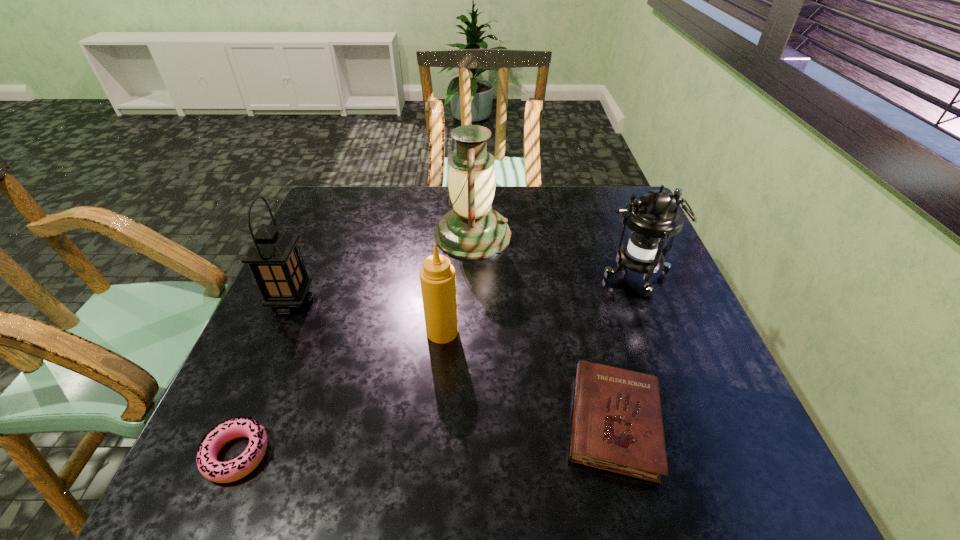
The height and width of the screenshot is (540, 960). What are the coordinates of `free location that satisfies the following two spatial constraints: 1. on the front side of the third nearest object; 2. on the right side of the leftmost lantern` in the screenshot? It's located at (279, 332).

This screenshot has height=540, width=960. What are the coordinates of `blank space that satisfies the following two spatial constraints: 1. with the light compartment facing forward on the hardback book; 2. on the left side of the second lantern from left to right` in the screenshot? It's located at (468, 423).

Find the location of a particular element. This screenshot has width=960, height=540. vacant space that satisfies the following two spatial constraints: 1. with the light compartment facing forward on the second lantern from left to right; 2. on the left side of the rightmost lantern is located at coordinates (471, 277).

The height and width of the screenshot is (540, 960). I want to click on free spot that satisfies the following two spatial constraints: 1. on the back side of the rightmost lantern; 2. on the left side of the hardback book, so click(577, 277).